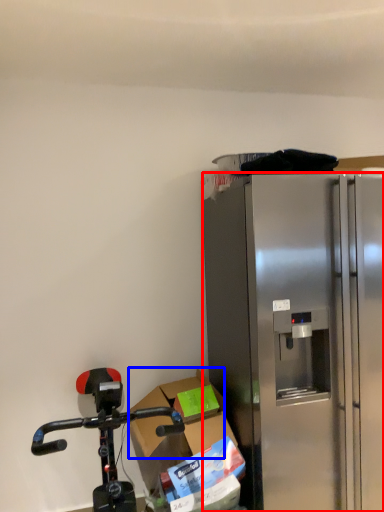
Question: Which point is closer to the camera, refrigerator (highlighted by a red box) or box (highlighted by a blue box)?

Choices:
 (A) refrigerator
 (B) box

Answer: (A)